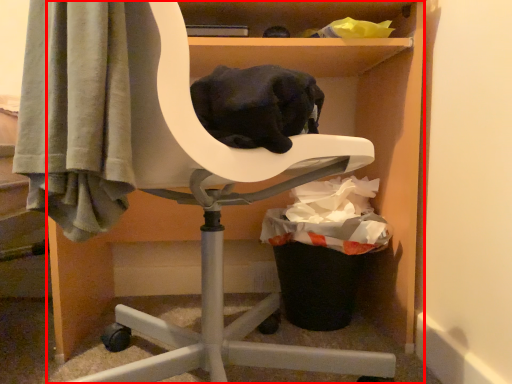
Question: Observing the image, what is the correct spatial positioning of furniture (annotated by the red box) in reference to garbage?

Choices:
 (A) right
 (B) left

Answer: (B)